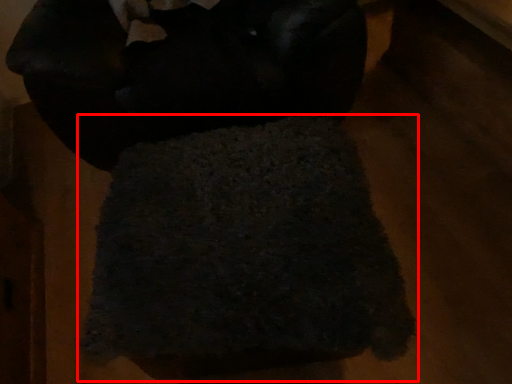
Question: From the image's perspective, considering the relative positions of towel (annotated by the red box) and wool in the image provided, where is towel (annotated by the red box) located with respect to the staircase?

Choices:
 (A) below
 (B) above

Answer: (A)